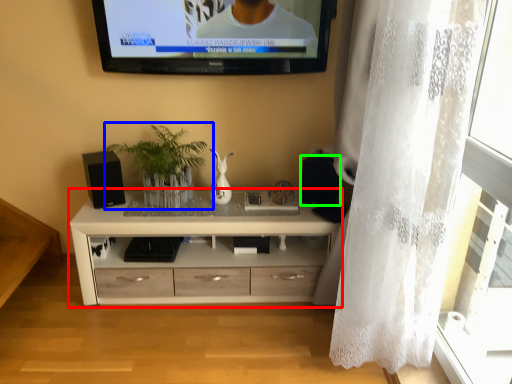
Question: Which object is positioned farthest from chest of drawers (highlighted by a red box)? Select from houseplant (highlighted by a blue box) and speaker (highlighted by a green box).

Choices:
 (A) houseplant
 (B) speaker

Answer: (B)